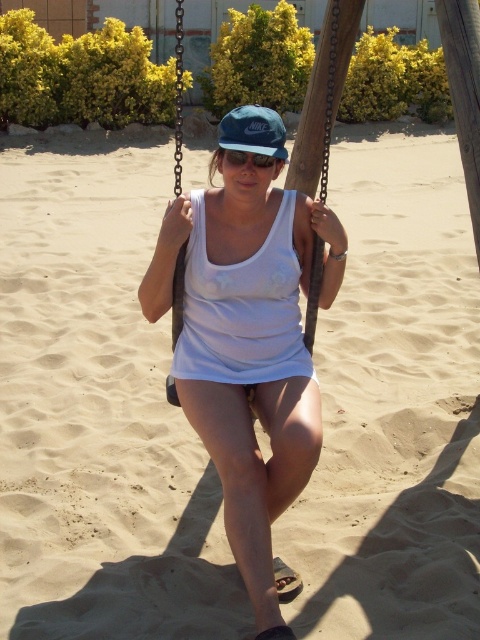
Question: Does metallic chain swing at center lie in front of green matte cap at center?

Choices:
 (A) yes
 (B) no

Answer: (B)

Question: Does white matte tank top at center have a greater width compared to green matte cap at center?

Choices:
 (A) no
 (B) yes

Answer: (A)

Question: Does metallic chain swing at center appear on the right side of green matte cap at center?

Choices:
 (A) yes
 (B) no

Answer: (B)

Question: Which object is positioned farthest from the green matte cap at center?

Choices:
 (A) metallic chain swing at center
 (B) matte black goggles at center

Answer: (A)

Question: Estimate the real-world distances between objects in this image. Which object is farther from the metallic chain swing at center?

Choices:
 (A) matte black goggles at center
 (B) white matte tank top at center

Answer: (A)

Question: Which point appears closest to the camera in this image?

Choices:
 (A) (261, 116)
 (B) (175, 294)

Answer: (A)